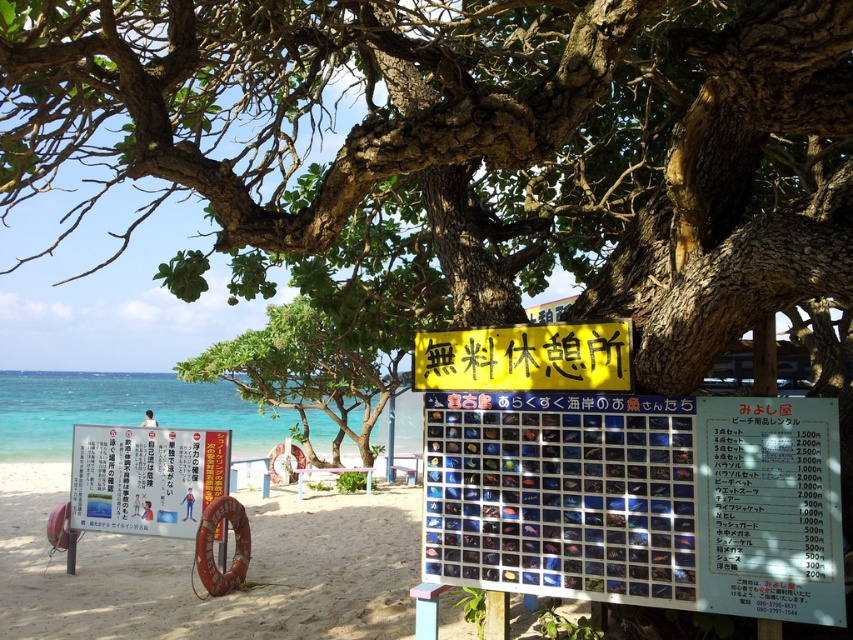
You are a tourist standing at the entrance of the beach and want to find the yellow paper at center. According to the coordinates given, where should you look relative to the large tree with sprawling branches and lush green foliage?

The yellow paper at center is located at coordinates point [637,500], which means it is positioned to the right and slightly below the large tree with sprawling branches and lush green foliage.